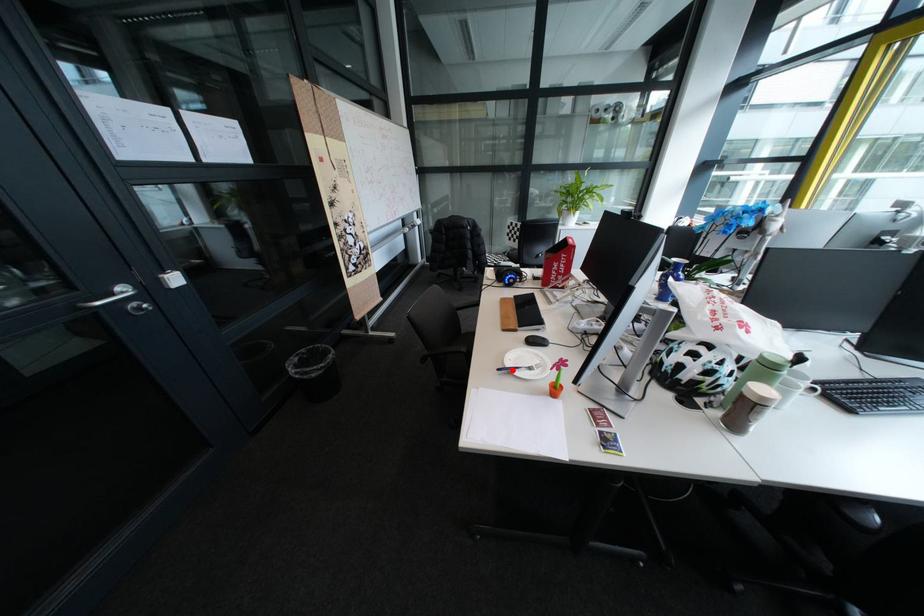
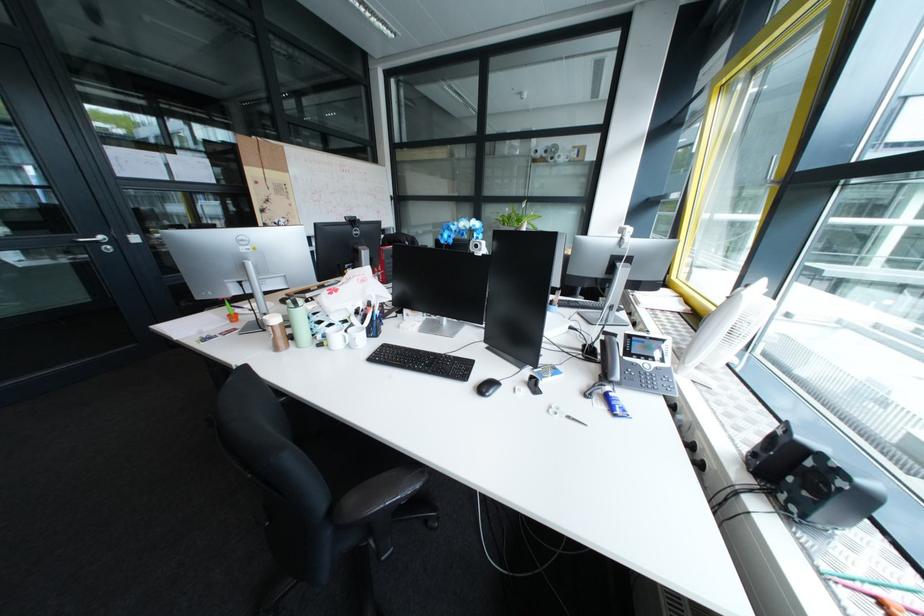
Question: I am providing you with two images of the same scene from different viewpoints. A red point is marked on the first image. Is the red point's position out of view in image 2?

Choices:
 (A) Yes
 (B) No

Answer: (A)